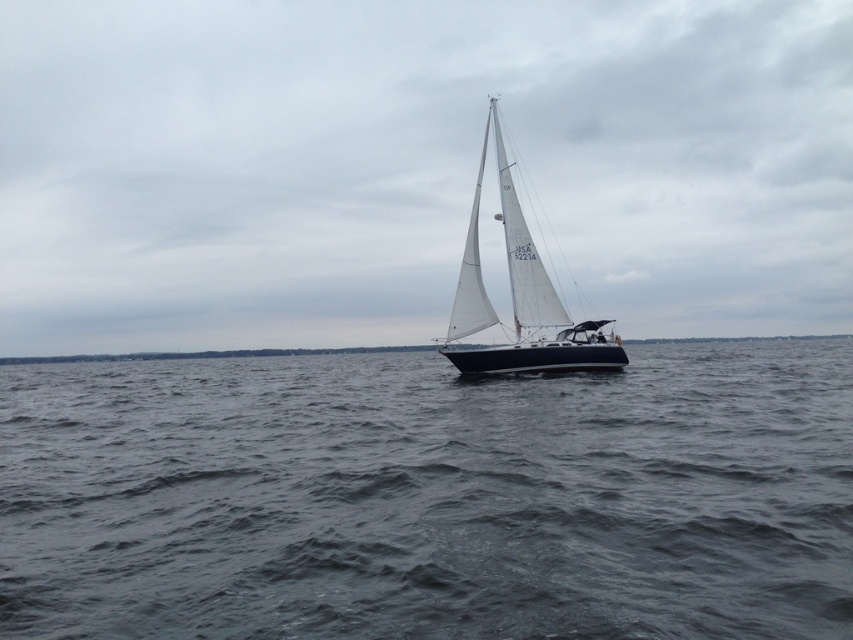
Question: Which point is farther to the camera?

Choices:
 (A) white matte sailboat at center
 (B) dark gray water at center

Answer: (A)

Question: Is dark gray water at center bigger than white matte sailboat at center?

Choices:
 (A) no
 (B) yes

Answer: (B)

Question: Which point appears closest to the camera in this image?

Choices:
 (A) (204, 476)
 (B) (543, 288)

Answer: (A)

Question: Does dark gray water at center have a lesser width compared to white matte sailboat at center?

Choices:
 (A) no
 (B) yes

Answer: (A)

Question: Where is dark gray water at center located in relation to white matte sailboat at center in the image?

Choices:
 (A) below
 (B) above

Answer: (A)